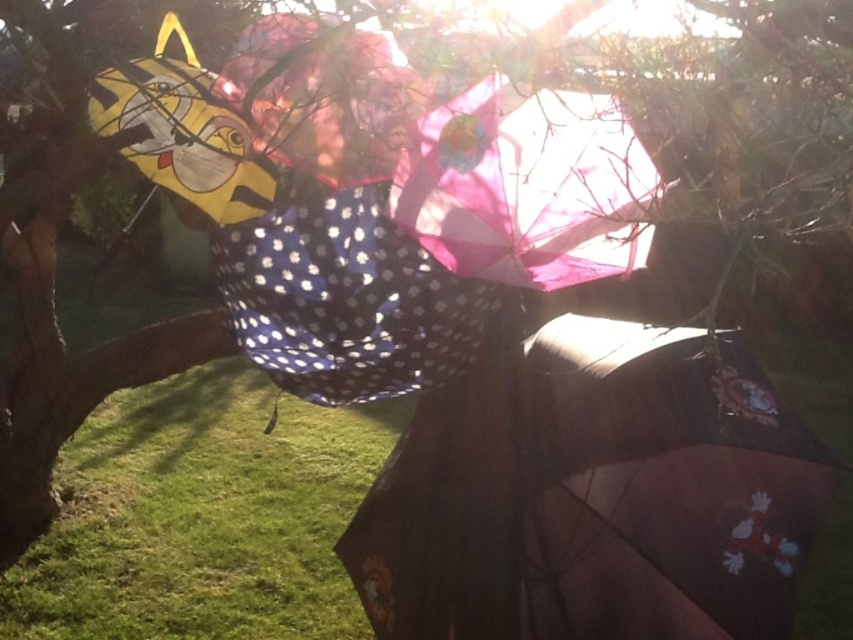
You are a park visitor holding a GPS device that shows coordinates. You see the polka dot fabric umbrella at center. What are its coordinates?

The coordinates of the polka dot fabric umbrella at center are at point (343, 240).

You are standing in a garden where you see a dark brown matte umbrella at lower right and a pink polka dot umbrella at center. Which umbrella is positioned lower in the image?

The dark brown matte umbrella at lower right is positioned lower in the image than the pink polka dot umbrella at center.

You are standing in a park and see the image. There is a polka dot fabric umbrella at center. Can you confirm if the polka dot fabric umbrella at center is exactly at the point with coordinates (343, 240)?

Yes, the point (343, 240) indicates the polka dot fabric umbrella at center, so it is exactly at that coordinate.